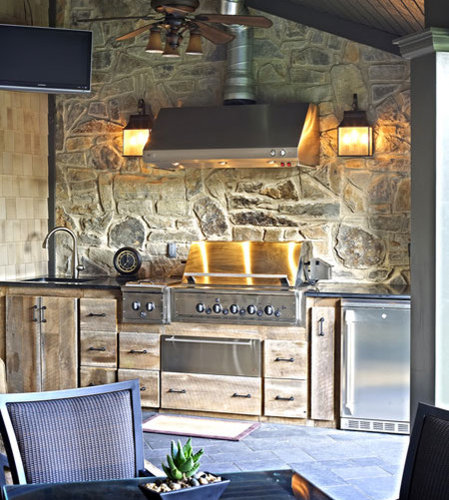
The image size is (449, 500). Find the location of `floor`. floor is located at coordinates (306, 465).